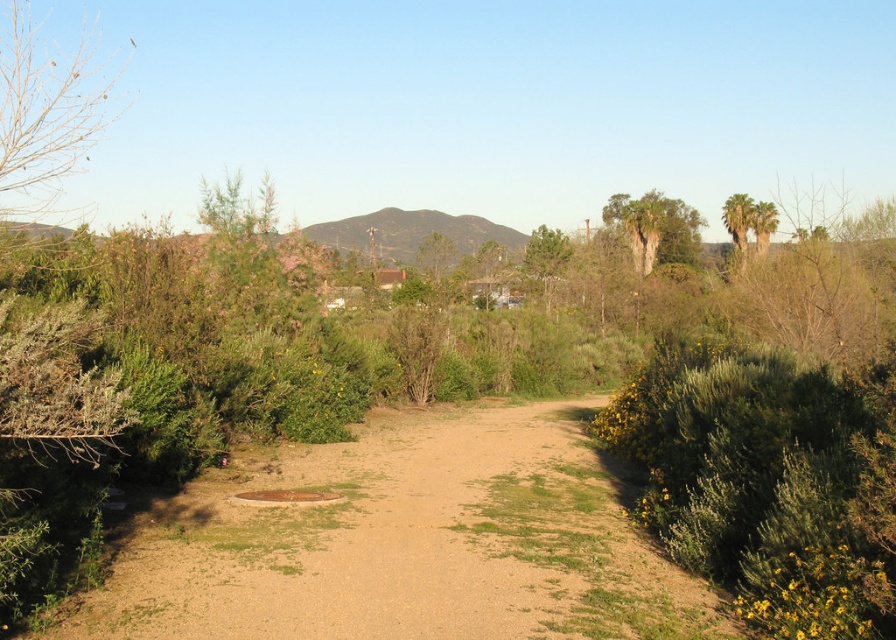
Can you confirm if green leafy bush at right is shorter than bare branches at upper left?

Correct, green leafy bush at right is not as tall as bare branches at upper left.

Does green leafy bush at right appear over bare branches at upper left?

Incorrect, green leafy bush at right is not positioned above bare branches at upper left.

The width and height of the screenshot is (896, 640). What do you see at coordinates (768, 483) in the screenshot?
I see `green leafy bush at right` at bounding box center [768, 483].

This screenshot has width=896, height=640. Identify the location of green leafy bush at right. (768, 483).

This screenshot has width=896, height=640. Describe the element at coordinates (768, 483) in the screenshot. I see `green leafy bush at right` at that location.

Who is shorter, green leafy bush at right or green textured palm tree at upper right?

Standing shorter between the two is green leafy bush at right.

I want to click on green leafy bush at right, so click(768, 483).

Is point (406, 502) positioned behind point (7, 60)?

No, (406, 502) is closer to viewer.

Image resolution: width=896 pixels, height=640 pixels. Describe the element at coordinates (405, 541) in the screenshot. I see `brown gravel path at center` at that location.

Find the location of a particular element. The height and width of the screenshot is (640, 896). brown gravel path at center is located at coordinates (405, 541).